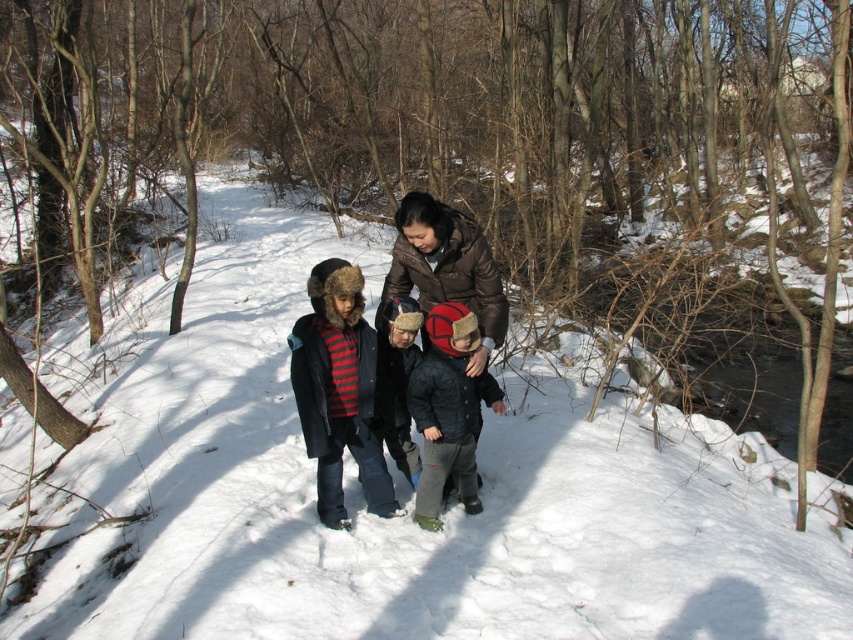
You are a photographer trying to capture a group photo of the dark blue jacket at center and brown fuzzy coat at center in the winter forest scene. The minimum focus distance for your camera is 16 inches. Will both subjects be in focus if you set the focus on the closer one?

The dark blue jacket at center and brown fuzzy coat at center are 16.17 inches apart. Since the minimum focus distance is 16 inches, both subjects will be in focus when focusing on the closer one because the distance between them is just slightly over the minimum required.